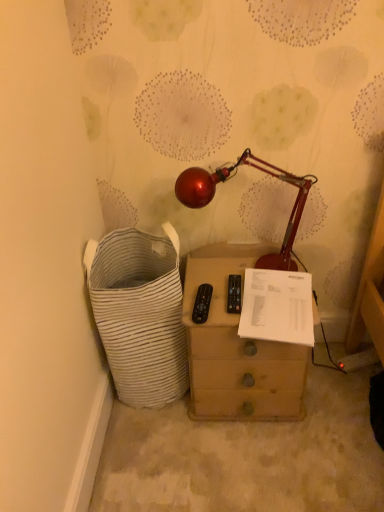
The image size is (384, 512). Identify the location of free space in front of white striped fabric laundry basket at left. (164, 463).